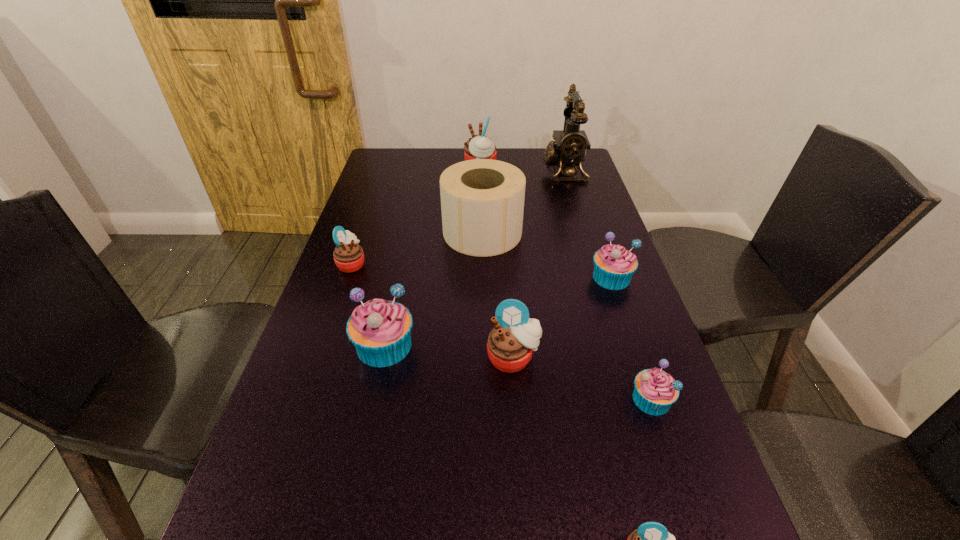
Where is `the smallest blue muffin`? The image size is (960, 540). the smallest blue muffin is located at coordinates (655, 391).

Find the location of a particular element. the eighth farthest object is located at coordinates (655, 391).

This screenshot has height=540, width=960. In order to click on free space located on the rotary dial of the tallest object in this screenshot , I will do `click(456, 170)`.

The image size is (960, 540). In order to click on vacant space located on the rotary dial of the tallest object in this screenshot , I will do `click(436, 170)`.

Locate an element on the screen. free point located on the rotary dial of the tallest object is located at coordinates (436, 170).

Identify the location of vacant space located 0.280m on the front-facing side of the biggest pink muffin. The image size is (960, 540). (387, 166).

The image size is (960, 540). Find the location of `free space located 0.070m on the front-facing side of the biggest pink muffin`. free space located 0.070m on the front-facing side of the biggest pink muffin is located at coordinates (444, 166).

Where is `vacant region located 0.260m on the front-facing side of the biggest pink muffin`? The width and height of the screenshot is (960, 540). vacant region located 0.260m on the front-facing side of the biggest pink muffin is located at coordinates (393, 166).

What are the coordinates of `vacant space located 0.280m on the left of the toilet tissue` in the screenshot? It's located at (348, 232).

This screenshot has height=540, width=960. In order to click on free space located 0.270m on the back of the sixth muffin from right to left in this screenshot , I will do `click(404, 251)`.